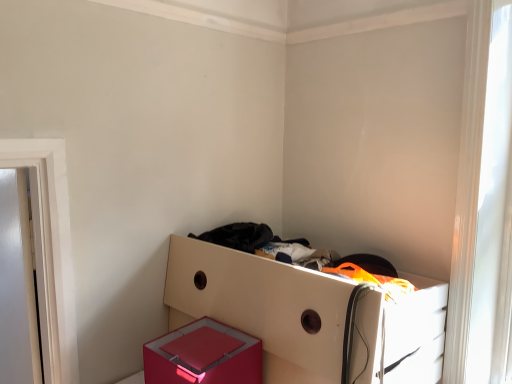
Question: Looking at their shapes, would you say shiny pink box at lower center is wider or thinner than white glossy drawer at center?

Choices:
 (A) thin
 (B) wide

Answer: (A)

Question: Based on their sizes in the image, would you say shiny pink box at lower center is bigger or smaller than white glossy drawer at center?

Choices:
 (A) big
 (B) small

Answer: (B)

Question: Based on their relative distances, which object is nearer to the white glossy drawer at center?

Choices:
 (A) shiny pink box at lower center
 (B) transparent glass window at upper right

Answer: (A)

Question: Which is nearer to the white glossy drawer at center?

Choices:
 (A) transparent glass window at upper right
 (B) shiny pink box at lower center

Answer: (B)